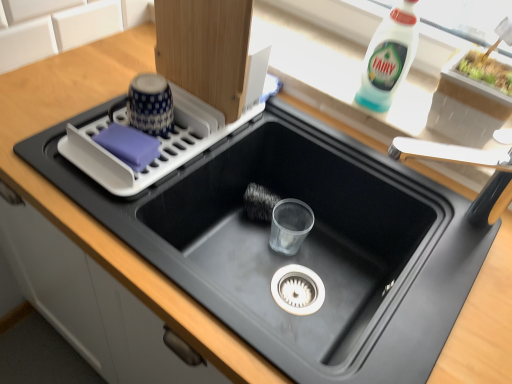
In order to click on unoccupied space behind white plastic bottle at upper right in this screenshot , I will do `click(346, 56)`.